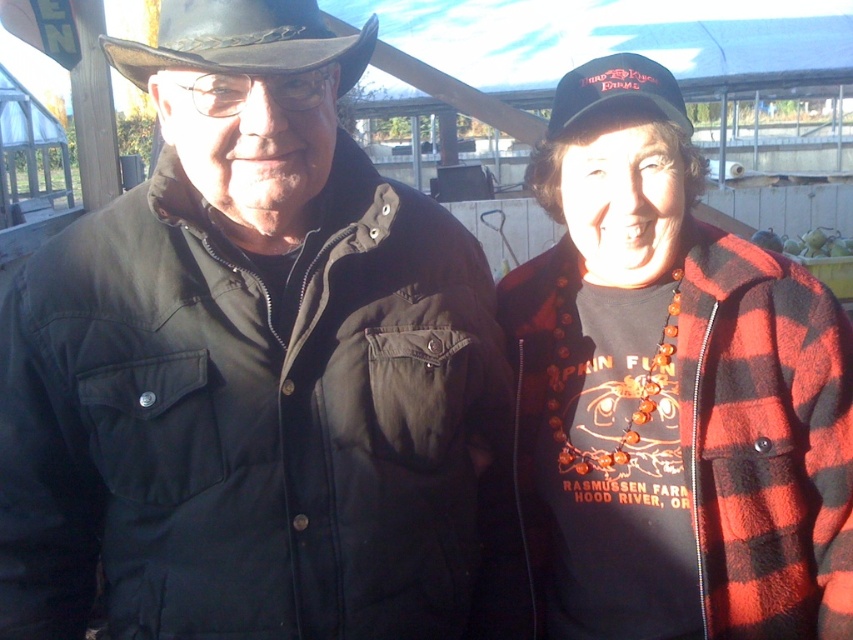
Question: Observing the image, what is the correct spatial positioning of matte black jacket at left in reference to red plaid jacket at right?

Choices:
 (A) below
 (B) above

Answer: (A)

Question: Which object appears closest to the camera in this image?

Choices:
 (A) red plaid jacket at right
 (B) matte black jacket at left
 (C) black fabric baseball cap at upper right

Answer: (B)

Question: Does matte black jacket at left have a larger size compared to brown leather cowboy hat at upper left?

Choices:
 (A) yes
 (B) no

Answer: (A)

Question: Is red plaid jacket at right below brown leather cowboy hat at upper left?

Choices:
 (A) yes
 (B) no

Answer: (A)

Question: Which point appears farthest from the camera in this image?

Choices:
 (A) (614, 81)
 (B) (392, 314)

Answer: (A)

Question: Which of the following is the closest to the observer?

Choices:
 (A) red plaid jacket at right
 (B) brown leather cowboy hat at upper left
 (C) matte black jacket at left

Answer: (C)